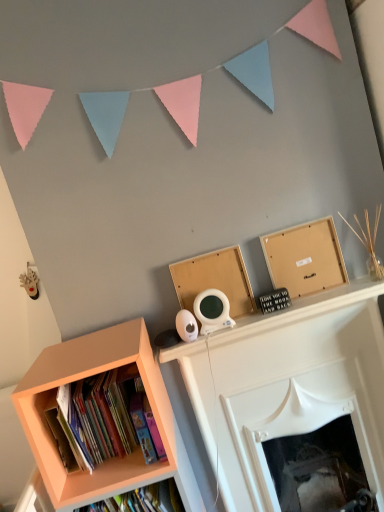
Question: Can you confirm if pastel paper flags at upper center is wider than bare wood board at upper center?

Choices:
 (A) no
 (B) yes

Answer: (A)

Question: Does pastel paper flags at upper center have a lesser width compared to bare wood board at upper center?

Choices:
 (A) no
 (B) yes

Answer: (B)

Question: Does pastel paper flags at upper center lie in front of bare wood board at upper center?

Choices:
 (A) no
 (B) yes

Answer: (B)

Question: Is pastel paper flags at upper center at the right side of bare wood board at upper center?

Choices:
 (A) no
 (B) yes

Answer: (A)

Question: Is pastel paper flags at upper center oriented away from bare wood board at upper center?

Choices:
 (A) no
 (B) yes

Answer: (A)

Question: Considering the relative positions of pastel paper flags at upper center and bare wood board at upper center in the image provided, is pastel paper flags at upper center behind bare wood board at upper center?

Choices:
 (A) no
 (B) yes

Answer: (A)

Question: Is bare wood board at upper center further to the viewer compared to matte orange bookcase at lower left?

Choices:
 (A) no
 (B) yes

Answer: (B)

Question: Could matte orange bookcase at lower left be considered to be inside bare wood board at upper center?

Choices:
 (A) no
 (B) yes

Answer: (A)

Question: From the image's perspective, is bare wood board at upper center on matte orange bookcase at lower left?

Choices:
 (A) no
 (B) yes

Answer: (B)

Question: Does bare wood board at upper center have a larger size compared to matte orange bookcase at lower left?

Choices:
 (A) yes
 (B) no

Answer: (B)

Question: From a real-world perspective, is bare wood board at upper center on top of matte orange bookcase at lower left?

Choices:
 (A) no
 (B) yes

Answer: (B)

Question: Does bare wood board at upper center come in front of matte orange bookcase at lower left?

Choices:
 (A) no
 (B) yes

Answer: (A)

Question: Is matte orange bookshelf at lower left not near matte orange bookcase at lower left?

Choices:
 (A) no
 (B) yes

Answer: (A)